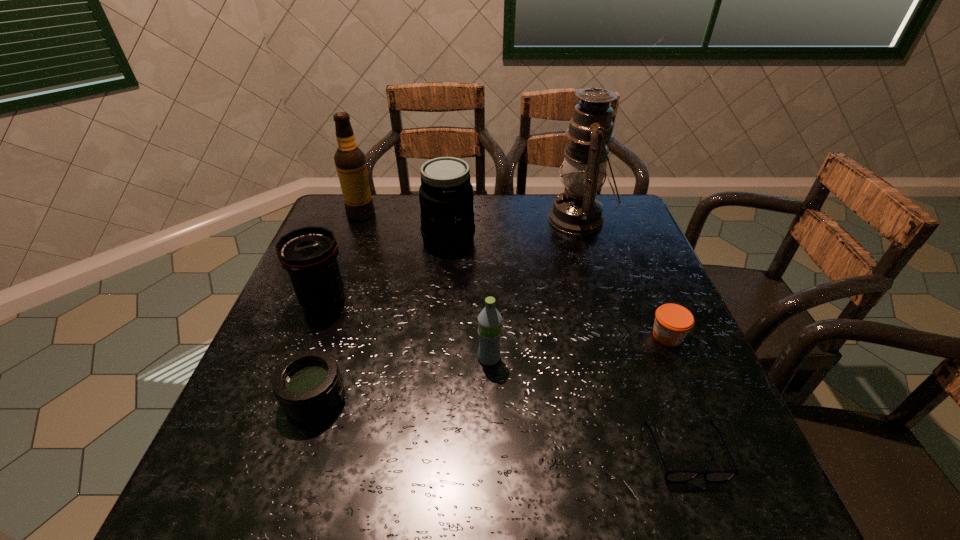
Locate an element on the screen. telephoto lens that is the closest to the fourth object from left to right is located at coordinates (309, 254).

This screenshot has width=960, height=540. What are the coordinates of `vacant point that satisfies the following two spatial constraints: 1. on the back side of the tallest telephoto lens; 2. on the left side of the oil lamp` in the screenshot? It's located at (450, 219).

What are the coordinates of `free space that satisfies the following two spatial constraints: 1. on the label of the tallest object; 2. on the right side of the seventh shortest object` in the screenshot? It's located at (359, 219).

Find the location of a particular element. The width and height of the screenshot is (960, 540). vacant area in the image that satisfies the following two spatial constraints: 1. on the front label of the jam; 2. on the front-facing side of the spectacles is located at coordinates (716, 451).

I want to click on vacant space that satisfies the following two spatial constraints: 1. on the label of the alcohol; 2. on the left side of the oil lamp, so click(x=359, y=219).